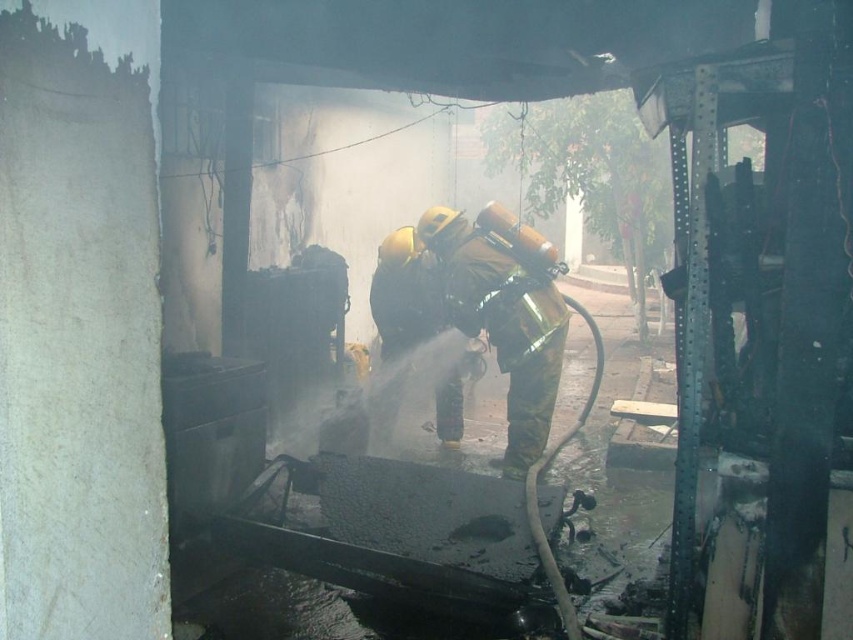
You are a safety inspector reviewing this emergency scene. You notice the camouflage fabric fireman at center and the shiny gold helmet at center. Which object is larger in size?

The camouflage fabric fireman at center is bigger than the shiny gold helmet at center according to the description.